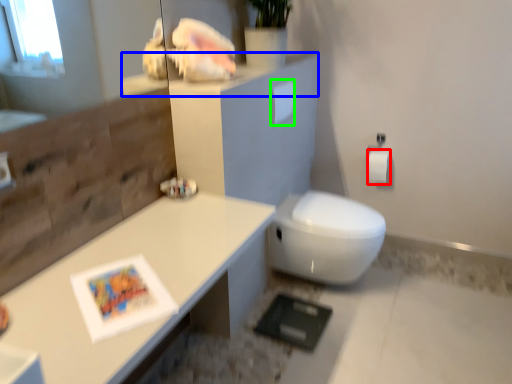
Question: Estimate the real-world distances between objects in this image. Which object is closer to toilet paper (highlighted by a red box), ledge (highlighted by a blue box) or toilet paper (highlighted by a green box)?

Choices:
 (A) ledge
 (B) toilet paper

Answer: (B)